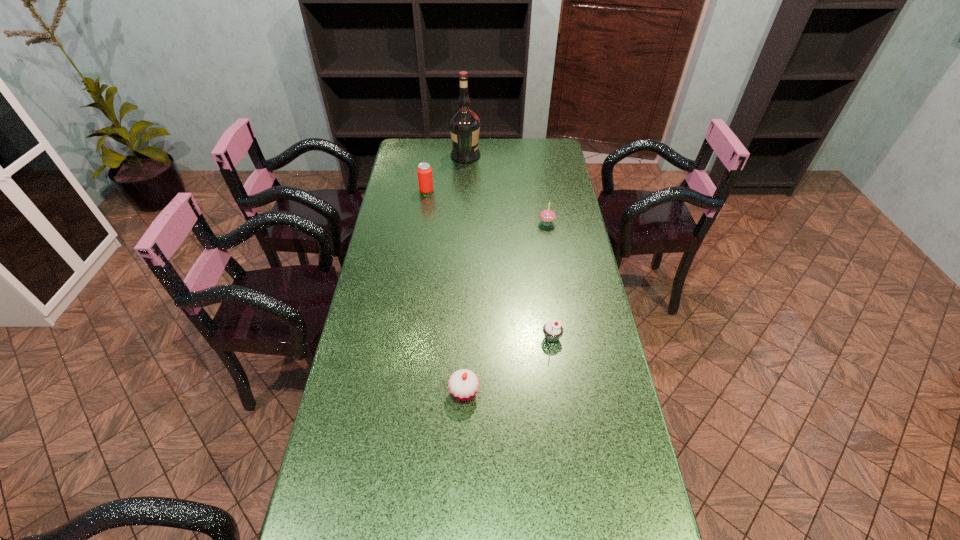
Locate an element on the screen. Image resolution: width=960 pixels, height=540 pixels. vacant area between the leftmost cupcake and the third nearest object is located at coordinates (506, 308).

Image resolution: width=960 pixels, height=540 pixels. Identify the location of vacant region between the liquor and the beer can. (446, 173).

Find the location of `free space between the farthest cupcake and the farthest object`. free space between the farthest cupcake and the farthest object is located at coordinates (506, 189).

The image size is (960, 540). Identify the location of free area in between the farthest cupcake and the leftmost cupcake. (506, 308).

Locate which object ranks fourth in proximity to the liquor. Please provide its 2D coordinates. Your answer should be formatted as a tuple, i.e. [(x, y)], where the tuple contains the x and y coordinates of a point satisfying the conditions above.

[(463, 384)]

Select which object appears as the fourth closest to the fourth farthest object. Please provide its 2D coordinates. Your answer should be formatted as a tuple, i.e. [(x, y)], where the tuple contains the x and y coordinates of a point satisfying the conditions above.

[(464, 124)]

Point out which cupcake is positioned as the third nearest to the farthest object. Please provide its 2D coordinates. Your answer should be formatted as a tuple, i.e. [(x, y)], where the tuple contains the x and y coordinates of a point satisfying the conditions above.

[(463, 384)]

Where is `cupcake that can be found as the closest to the farthest cupcake`? cupcake that can be found as the closest to the farthest cupcake is located at coordinates (552, 330).

Find the location of a particular element. Image resolution: width=960 pixels, height=540 pixels. vacant space that satisfies the following two spatial constraints: 1. on the surface of the liquor; 2. on the right side of the second farthest cupcake is located at coordinates click(x=458, y=338).